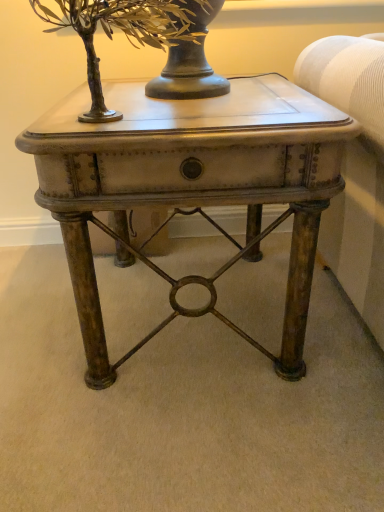
This screenshot has height=512, width=384. I want to click on free location in front of green metallic tree at upper center, so click(x=124, y=127).